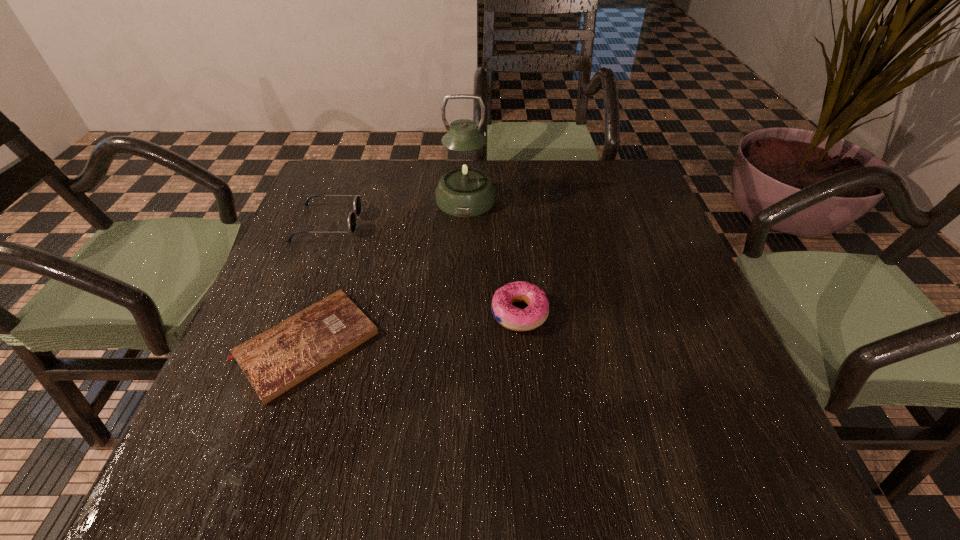
Locate an element on the screen. The width and height of the screenshot is (960, 540). object that stands as the closest to the shortest object is located at coordinates (357, 201).

Locate an element on the screen. The height and width of the screenshot is (540, 960). free space that satisfies the following two spatial constraints: 1. on the front-facing side of the sunglasses; 2. on the back side of the shortest object is located at coordinates click(279, 345).

What are the coordinates of `vacant area that satisfies the following two spatial constraints: 1. on the front-facing side of the sunglasses; 2. on the right side of the doughnut` in the screenshot? It's located at (292, 313).

Where is `free space that satisfies the following two spatial constraints: 1. on the front side of the lantern; 2. on the front-facing side of the sunglasses`? Image resolution: width=960 pixels, height=540 pixels. free space that satisfies the following two spatial constraints: 1. on the front side of the lantern; 2. on the front-facing side of the sunglasses is located at coordinates (465, 223).

The image size is (960, 540). Identify the location of free space that satisfies the following two spatial constraints: 1. on the front-facing side of the sunglasses; 2. on the right side of the doughnut. (292, 313).

Where is `vacant area that satisfies the following two spatial constraints: 1. on the back side of the Bible; 2. on the front-facing side of the sunglasses`? The image size is (960, 540). vacant area that satisfies the following two spatial constraints: 1. on the back side of the Bible; 2. on the front-facing side of the sunglasses is located at coordinates (348, 223).

Where is `vacant space that satisfies the following two spatial constraints: 1. on the front-facing side of the sunglasses; 2. on the right side of the doughnut`? The image size is (960, 540). vacant space that satisfies the following two spatial constraints: 1. on the front-facing side of the sunglasses; 2. on the right side of the doughnut is located at coordinates pyautogui.click(x=292, y=313).

This screenshot has height=540, width=960. I want to click on free location that satisfies the following two spatial constraints: 1. on the front-facing side of the shortest object; 2. on the left side of the sunglasses, so click(279, 345).